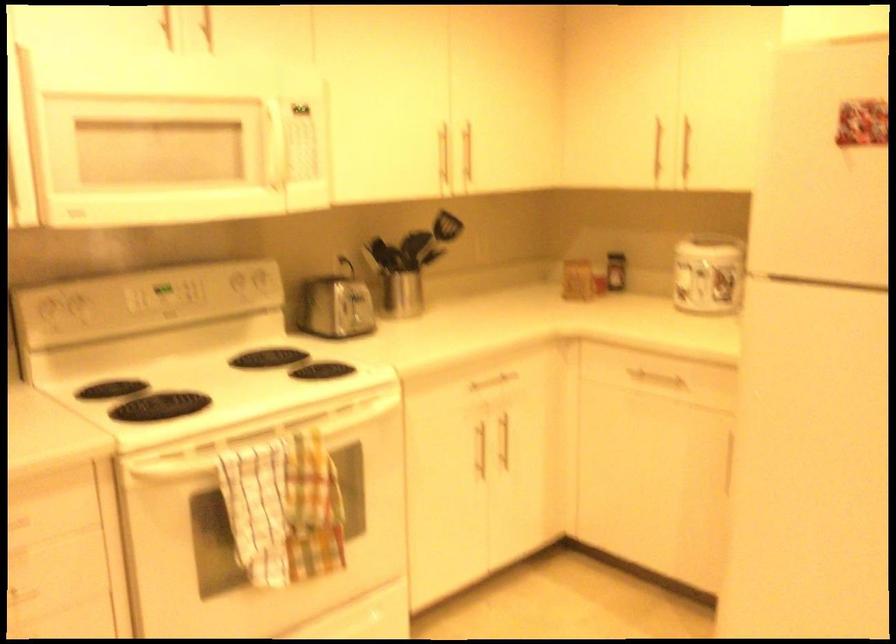
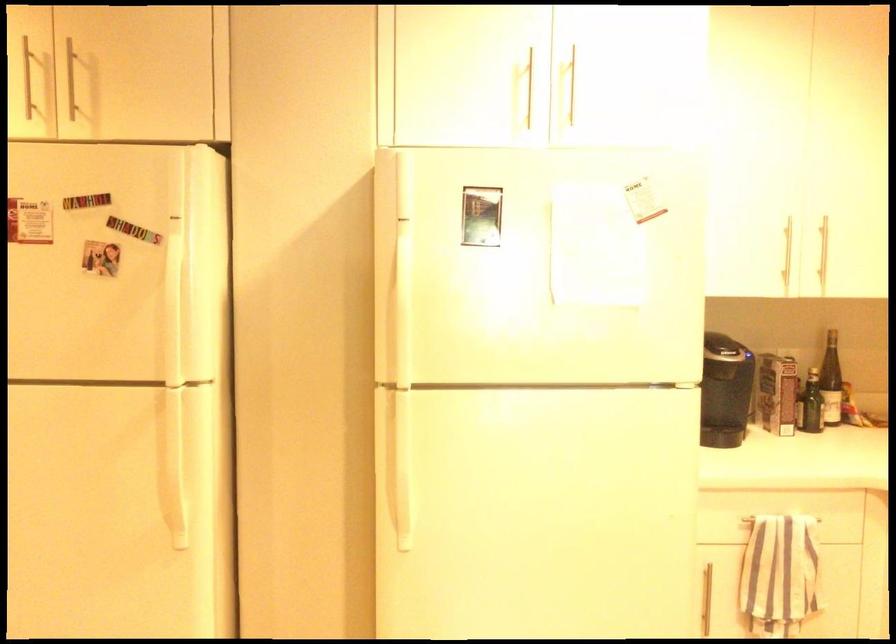
Question: The camera is either moving clockwise (left) or counter-clockwise (right) around the object. The first image is from the beginning of the video and the second image is from the end. Is the camera moving left or right when shooting the video?

Choices:
 (A) Left
 (B) Right

Answer: (A)